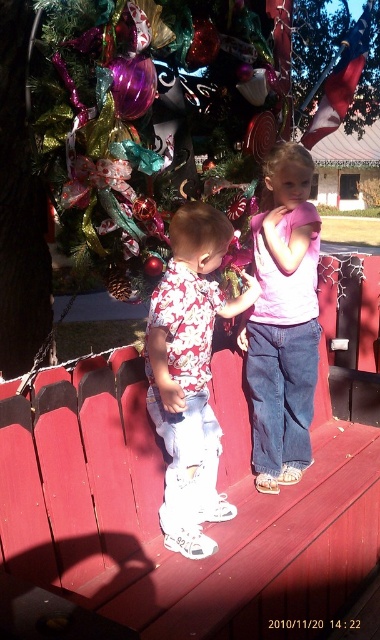
Is floral fabric shirt at center further to camera compared to metallic red flag at upper center?

No, floral fabric shirt at center is closer to the viewer.

Can you confirm if floral fabric shirt at center is thinner than metallic red flag at upper center?

Yes.

Is point (177, 508) more distant than point (330, 131)?

No, (177, 508) is in front of (330, 131).

Find the location of a particular element. The image size is (380, 640). floral fabric shirt at center is located at coordinates [190, 374].

Can you confirm if shiny metallic ornaments at center is thinner than pink cotton shirt at center?

No.

The width and height of the screenshot is (380, 640). Describe the element at coordinates (145, 108) in the screenshot. I see `shiny metallic ornaments at center` at that location.

Where is `shiny metallic ornaments at center`? The image size is (380, 640). shiny metallic ornaments at center is located at coordinates (145, 108).

The image size is (380, 640). I want to click on shiny metallic ornaments at center, so click(x=145, y=108).

Measure the distance between pink cotton shirt at center and camera.

The distance of pink cotton shirt at center from camera is 2.13 meters.

Does pink cotton shirt at center have a lesser width compared to metallic red flag at upper center?

Indeed, pink cotton shirt at center has a lesser width compared to metallic red flag at upper center.

Locate an element on the screen. Image resolution: width=380 pixels, height=640 pixels. pink cotton shirt at center is located at coordinates (283, 321).

Where is `pink cotton shirt at center`? pink cotton shirt at center is located at coordinates (283, 321).